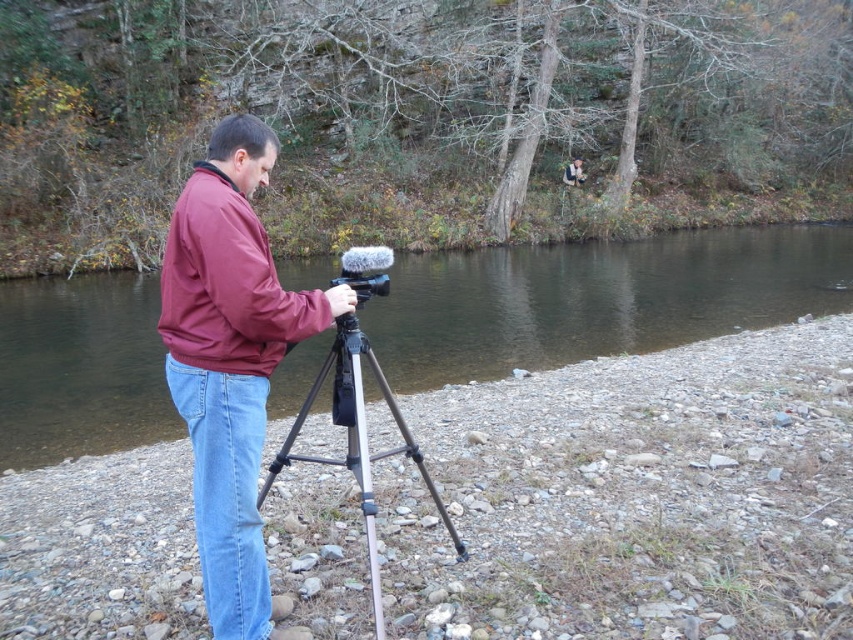
You are a photographer who wants to capture the reflection of the clear water at center in your shot. Since the light blue denim jeans at lower left might interfere with the reflection, how can you adjust your position to avoid it?

The clear water at center is larger than the light blue denim jeans at lower left, so you can move your camera position slightly to the right to frame the larger clear water at center while excluding the smaller light blue denim jeans at lower left from the reflection area.

You are a photographer who needs to place a small tripod between the clear water at center and the light blue denim jeans at lower left. Based on their positions, where should you position the tripod to ensure it is between both objects?

The clear water at center is to the right of the light blue denim jeans at lower left, so the tripod should be placed between them, closer to the center where the clear water is located to ensure it is between both objects.